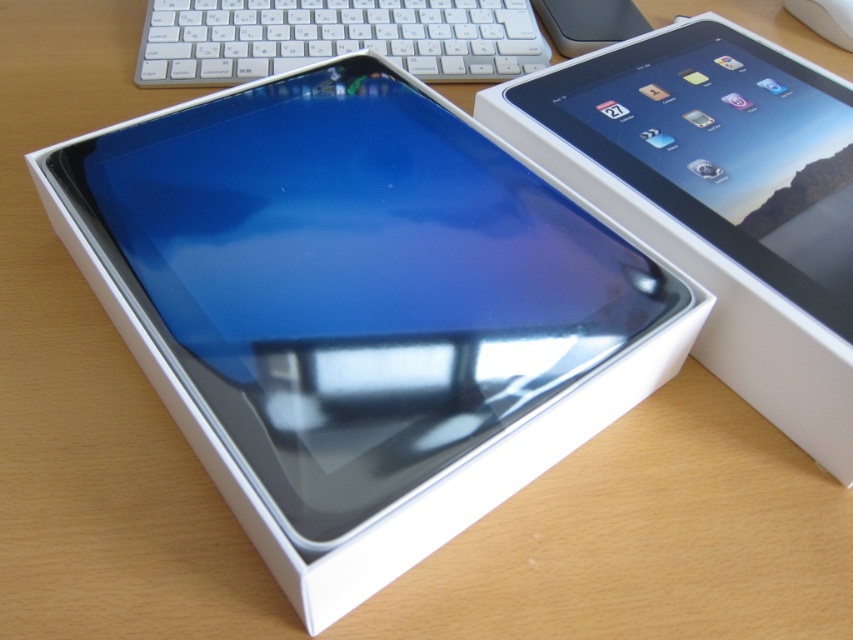
You are setting up a new tablet and need to place it on a desk. The desk has a coordinate system where the bottom left corner is the origin. The satin black tablet at upper right is currently at position coordinates. Can you confirm if the tablet is positioned in the upper right quadrant of the desk?

The satin black tablet at upper right is located at point coordinates, which places it in the upper right quadrant of the desk.

From the picture: You are trying to decide which tablet to choose between the satin black tablet at center and the satin black tablet at upper right. Both are similar in appearance. If you want the one with a larger screen, which one should you pick?

The satin black tablet at center is wider than the satin black tablet at upper right, so it has a larger screen and you should pick the satin black tablet at center.

You are setting up a new tablet and need to place it precisely on a grid. The tablet must be positioned at coordinates that match its current location in the image. What are the coordinates where the satin black tablet at center should be placed?

The satin black tablet at center should be placed at coordinates point (354, 285) as it is located there in the image.